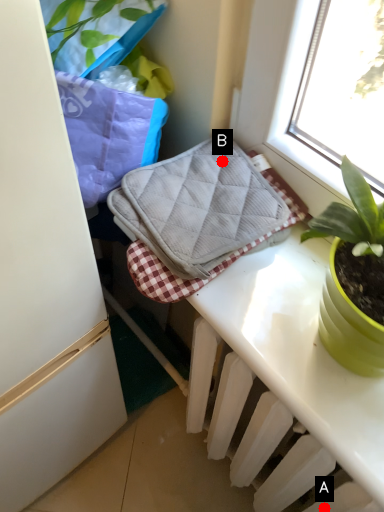
Question: Two points are circled on the image, labeled by A and B beside each circle. Which point appears farthest from the camera in this image?

Choices:
 (A) A is further
 (B) B is further

Answer: (B)